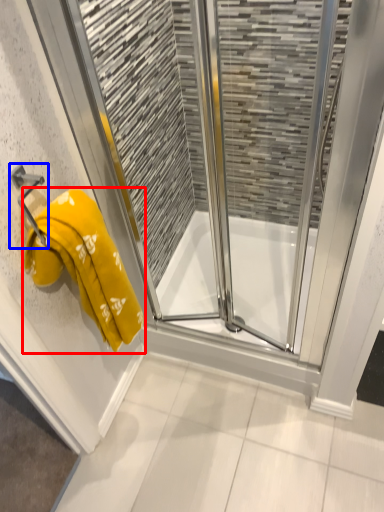
Question: Which object is further to the camera taking this photo, towel (highlighted by a red box) or towel bar (highlighted by a blue box)?

Choices:
 (A) towel
 (B) towel bar

Answer: (B)